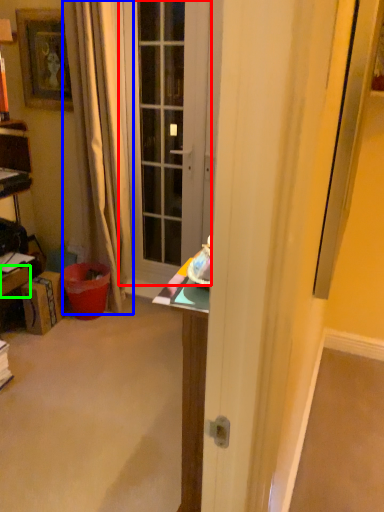
Question: Which object is positioned closest to door (highlighted by a red box)? Select from curtain (highlighted by a blue box) and drawer (highlighted by a green box).

Choices:
 (A) curtain
 (B) drawer

Answer: (A)